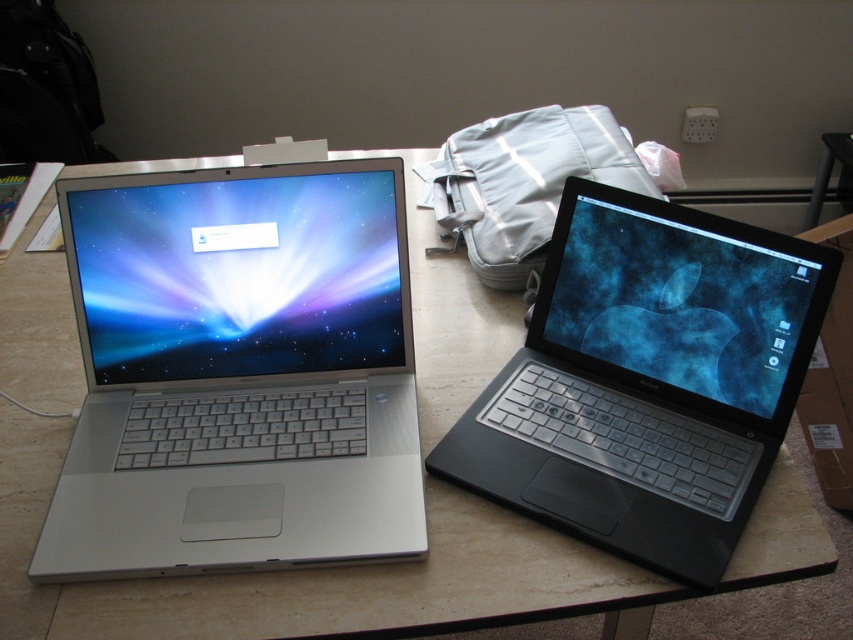
Does point (281, 273) come farther from viewer compared to point (573, 124)?

No, (281, 273) is closer to viewer.

You are a GUI agent. You are given a task and a screenshot of the screen. Output one action in this format:
    pyautogui.click(x=<x>, y=<y>)
    Task: Click on the silver metallic laptop at left
    Image resolution: width=853 pixels, height=640 pixels.
    Given the screenshot: What is the action you would take?
    pyautogui.click(x=238, y=371)

Does silver metallic laptop at left appear on the right side of black glossy laptop at right?

Incorrect, silver metallic laptop at left is not on the right side of black glossy laptop at right.

Who is more forward, (222, 228) or (660, 250)?

Point (222, 228)

Identify the location of silver metallic laptop at left. (238, 371).

Which of these two, black glossy laptop at right or matte white backpack at center, stands taller?

black glossy laptop at right

Does black glossy laptop at right have a greater height compared to matte white backpack at center?

Indeed, black glossy laptop at right has a greater height compared to matte white backpack at center.

Does point (492, 486) come in front of point (618, 154)?

Yes.

This screenshot has height=640, width=853. In order to click on black glossy laptop at right in this screenshot , I will do `click(648, 380)`.